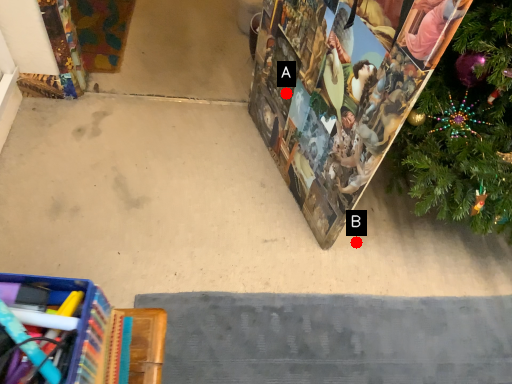
Question: Two points are circled on the image, labeled by A and B beside each circle. Which point appears farthest from the camera in this image?

Choices:
 (A) A is further
 (B) B is further

Answer: (B)